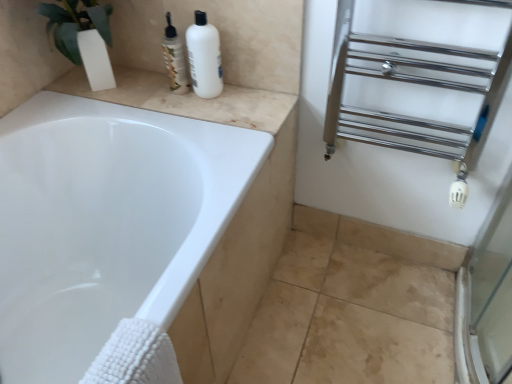
Locate an element on the screen. This screenshot has width=512, height=384. free location to the right of translucent plastic bottles at upper center is located at coordinates (244, 100).